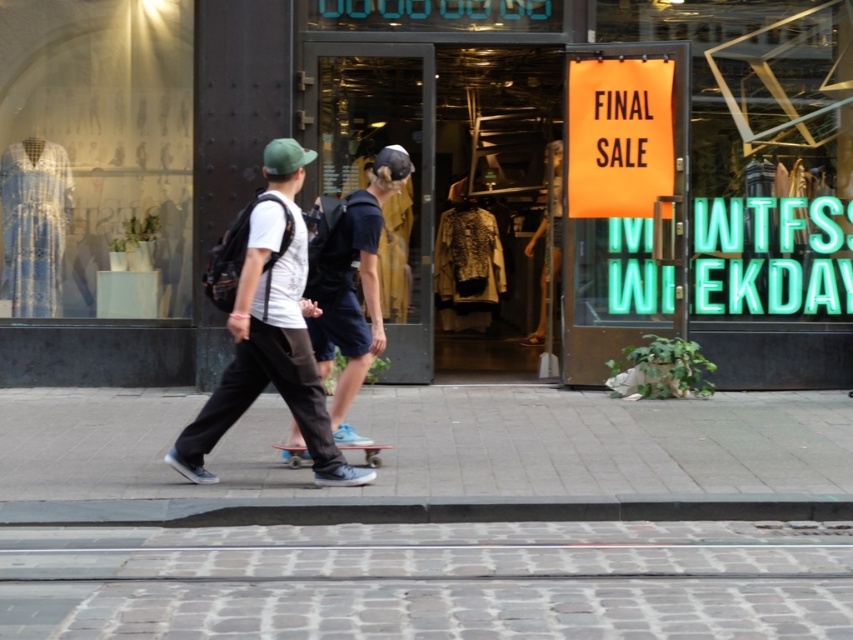
Question: Can you confirm if white textured pavement at lower center is positioned above dark gray pants at center?

Choices:
 (A) yes
 (B) no

Answer: (B)

Question: Does gray concrete pavement at center have a lesser width compared to dark gray pants at center?

Choices:
 (A) yes
 (B) no

Answer: (B)

Question: Which point is closer to the camera?

Choices:
 (A) matte black sign at center
 (B) white textured pavement at lower center

Answer: (B)

Question: Is white textured pavement at lower center thinner than light blue deck at center?

Choices:
 (A) no
 (B) yes

Answer: (A)

Question: Estimate the real-world distances between objects in this image. Which object is closer to the matte black skateboard at center?

Choices:
 (A) white textured pavement at lower center
 (B) matte glass dress at left
 (C) gray concrete pavement at center
 (D) dark gray pants at center

Answer: (D)

Question: Which object appears farthest from the camera in this image?

Choices:
 (A) matte black skateboard at center
 (B) matte black sign at center
 (C) dark gray pants at center
 (D) light blue deck at center

Answer: (B)